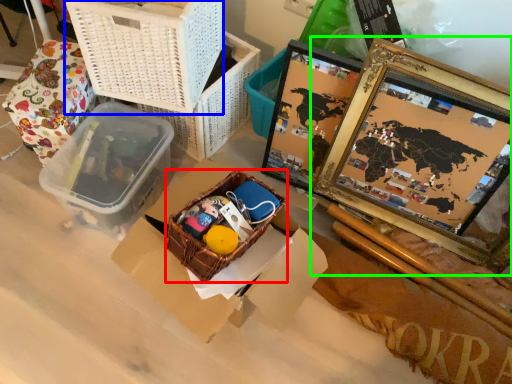
Question: Which object is the farthest from gift basket (highlighted by a red box)? Choose among these: basket (highlighted by a blue box) or picture frame (highlighted by a green box).

Choices:
 (A) basket
 (B) picture frame

Answer: (B)